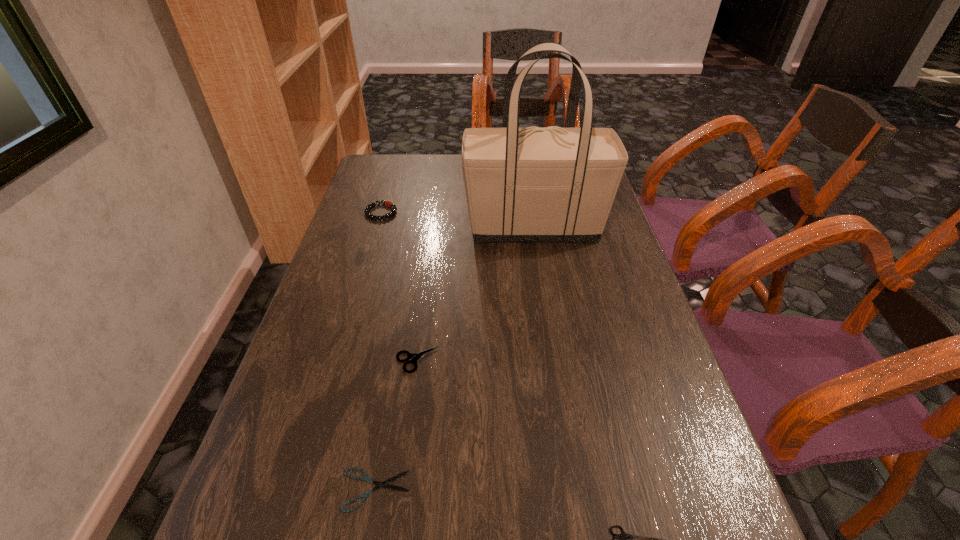
The width and height of the screenshot is (960, 540). Identify the location of free space located 0.170m on the back of the fourth shortest object. (392, 176).

The width and height of the screenshot is (960, 540). Identify the location of free spot located on the left of the tallest shears. (367, 361).

The width and height of the screenshot is (960, 540). I want to click on vacant space located on the right of the shortest object, so click(x=490, y=489).

Locate an element on the screen. Image resolution: width=960 pixels, height=540 pixels. object positioned at the left edge is located at coordinates (389, 204).

Where is `object at the right edge`? object at the right edge is located at coordinates (553, 184).

The image size is (960, 540). I want to click on vacant point at the left edge, so click(x=325, y=516).

Locate an element on the screen. Image resolution: width=960 pixels, height=540 pixels. free space at the right edge is located at coordinates (623, 294).

I want to click on free space that is in between the second tallest object and the farthest shears, so click(399, 286).

You are a GUI agent. You are given a task and a screenshot of the screen. Output one action in this format:
    pyautogui.click(x=<x>, y=<y>)
    Task: Click on the empty location between the tallest object and the third nearest object
    This screenshot has height=540, width=960.
    Given the screenshot: What is the action you would take?
    pyautogui.click(x=475, y=294)

The width and height of the screenshot is (960, 540). Find the location of `blank region between the second farthest shears and the shopping bag`. blank region between the second farthest shears and the shopping bag is located at coordinates (455, 359).